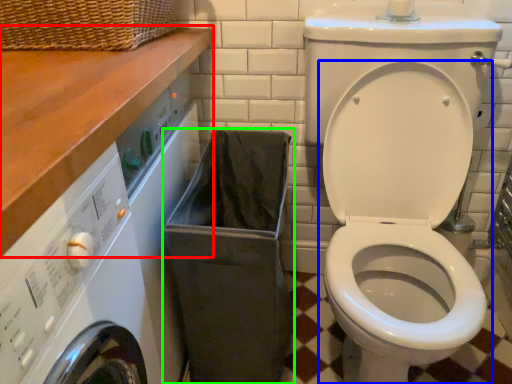
Question: Which object is positioned closest to counter top (highlighted by a red box)? Select from toilet (highlighted by a blue box) and laundry basket (highlighted by a green box).

Choices:
 (A) toilet
 (B) laundry basket

Answer: (B)